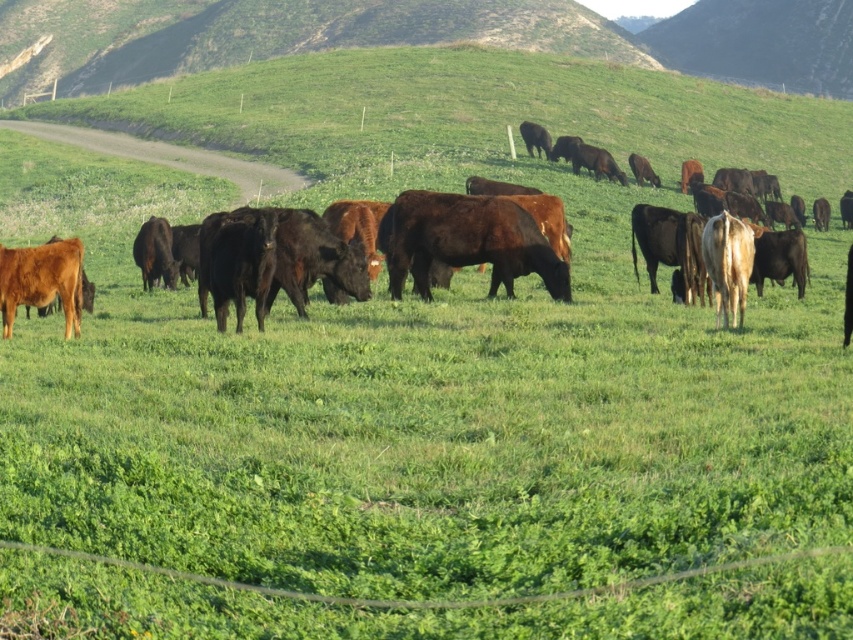
You are a farmer checking the pasture. You notice the brown glossy bull at center and the brown glossy cow at lower left. Which animal would cast a larger shadow if the sun is directly overhead?

The brown glossy bull at center is bigger than the brown glossy cow at lower left, so it would cast a larger shadow.

You are standing at the origin point of the coordinate system in this image. You want to walk to the brown glossy cows at center. Which direction should you move in terms of the coordinate system?

Since the brown glossy cows at center are located at point (x=170, y=156) in the 2D coordinate system, you should move towards the positive x and positive y directions to reach them.

You are a farmer assessing the height of your cattle. You notice the brown glossy bull at center and the brown glossy cow at lower left. Which one do you think is taller?

The brown glossy bull at center is taller than the brown glossy cow at lower left.